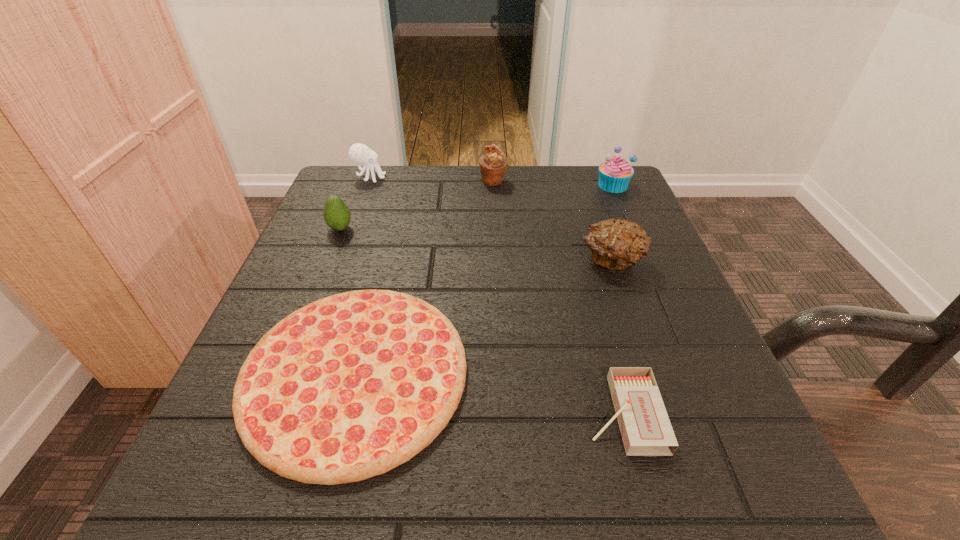
Identify the location of matchbox present at the right edge. (644, 424).

The width and height of the screenshot is (960, 540). I want to click on object that is at the far left corner, so click(359, 153).

You are a GUI agent. You are given a task and a screenshot of the screen. Output one action in this format:
    pyautogui.click(x=<x>, y=<y>)
    Task: Click on the object at the near left corner
    This screenshot has width=960, height=540.
    Given the screenshot: What is the action you would take?
    pyautogui.click(x=348, y=387)

Locate an element on the screen. The image size is (960, 540). object situated at the far right corner is located at coordinates (614, 175).

The image size is (960, 540). I want to click on object that is at the near right corner, so click(644, 424).

You are a GUI agent. You are given a task and a screenshot of the screen. Output one action in this format:
    pyautogui.click(x=<x>, y=<y>)
    Task: Click on the blank space at the far edge
    Image resolution: width=960 pixels, height=540 pixels.
    Given the screenshot: What is the action you would take?
    pyautogui.click(x=550, y=211)

Locate an element on the screen. The image size is (960, 540). vacant space at the near edge of the desktop is located at coordinates (505, 495).

The height and width of the screenshot is (540, 960). In the image, there is a desktop. Identify the location of vacant space at the left edge. (334, 286).

Locate an element on the screen. This screenshot has height=540, width=960. vacant space at the right edge is located at coordinates (657, 294).

In the image, there is a desktop. At what (x,y) coordinates should I click in order to perform the action: click on free region at the far left corner. Please return your answer as a coordinate pair (x, y). This screenshot has width=960, height=540. Looking at the image, I should click on (396, 192).